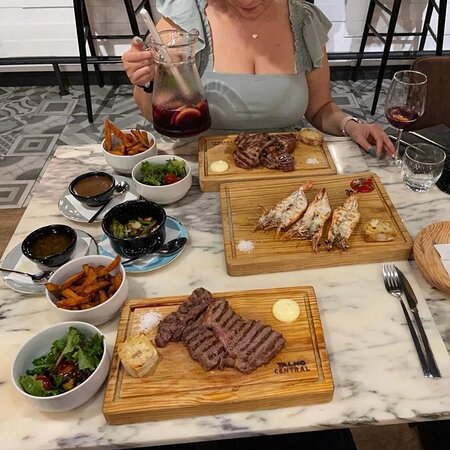
Identify the location of table. (361, 288).